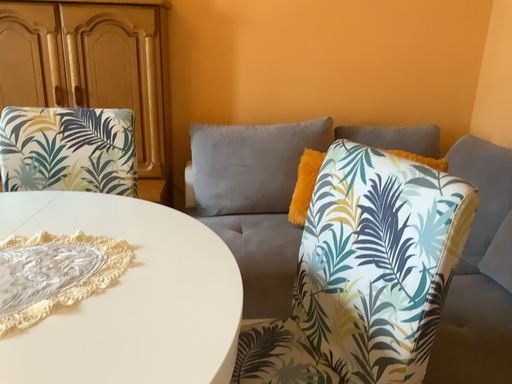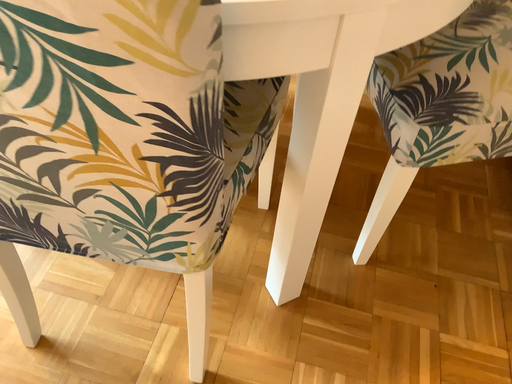
Question: Which way did the camera rotate in the video?

Choices:
 (A) rotated right
 (B) rotated left

Answer: (B)